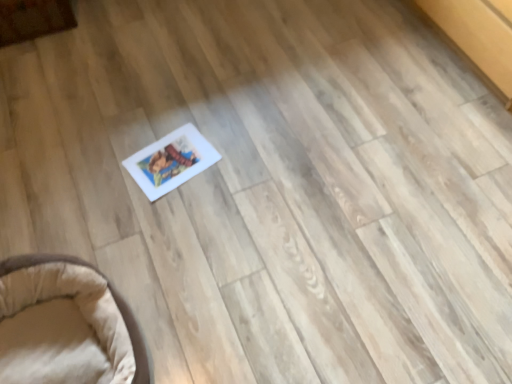
Question: Is beige fabric pet bed at lower left, which is the first furniture in front-to-back order, positioned beyond the bounds of wooden cabinet at upper left, the second furniture in the front-to-back sequence?

Choices:
 (A) no
 (B) yes

Answer: (B)

Question: Considering the relative sizes of beige fabric pet bed at lower left, placed as the 1th furniture when sorted from right to left, and wooden cabinet at upper left, which appears as the second furniture when ordered from the bottom, in the image provided, is beige fabric pet bed at lower left, placed as the 1th furniture when sorted from right to left, shorter than wooden cabinet at upper left, which appears as the second furniture when ordered from the bottom,?

Choices:
 (A) yes
 (B) no

Answer: (B)

Question: Is beige fabric pet bed at lower left, which appears as the second furniture when viewed from the top, facing towards wooden cabinet at upper left, which appears as the second furniture when ordered from the bottom?

Choices:
 (A) no
 (B) yes

Answer: (A)

Question: Can you confirm if beige fabric pet bed at lower left, placed as the 1th furniture when sorted from right to left, is thinner than wooden cabinet at upper left, the 1th furniture from the left?

Choices:
 (A) no
 (B) yes

Answer: (A)

Question: Is beige fabric pet bed at lower left, which appears as the 1th furniture when ordered from the bottom, not close to wooden cabinet at upper left, the second furniture in the front-to-back sequence?

Choices:
 (A) no
 (B) yes

Answer: (B)

Question: Can wooden cabinet at upper left, which appears as the second furniture when ordered from the bottom, be found inside beige fabric pet bed at lower left, which is the first furniture in front-to-back order?

Choices:
 (A) yes
 (B) no

Answer: (B)

Question: Could you tell me if wooden cabinet at upper left, which ranks as the second furniture in right-to-left order, is facing beige fabric pet bed at lower left, which is the first furniture in front-to-back order?

Choices:
 (A) yes
 (B) no

Answer: (A)

Question: From the image's perspective, is wooden cabinet at upper left, the 1th furniture positioned from the top, above beige fabric pet bed at lower left, which is the second furniture from back to front?

Choices:
 (A) yes
 (B) no

Answer: (A)

Question: From a real-world perspective, is wooden cabinet at upper left, the 1th furniture positioned from the top, positioned over beige fabric pet bed at lower left, which appears as the second furniture when viewed from the top, based on gravity?

Choices:
 (A) yes
 (B) no

Answer: (B)

Question: Considering the relative sizes of wooden cabinet at upper left, marked as the first furniture in a back-to-front arrangement, and beige fabric pet bed at lower left, which is the second furniture from back to front, in the image provided, is wooden cabinet at upper left, marked as the first furniture in a back-to-front arrangement, taller than beige fabric pet bed at lower left, which is the second furniture from back to front,?

Choices:
 (A) yes
 (B) no

Answer: (B)

Question: Does wooden cabinet at upper left, the 1th furniture positioned from the top, have a greater width compared to beige fabric pet bed at lower left, placed as the 1th furniture when sorted from right to left?

Choices:
 (A) yes
 (B) no

Answer: (B)

Question: Is wooden cabinet at upper left, marked as the first furniture in a back-to-front arrangement, positioned beyond the bounds of beige fabric pet bed at lower left, which is the second furniture from back to front?

Choices:
 (A) no
 (B) yes

Answer: (B)

Question: Do you think beige fabric pet bed at lower left, which is the first furniture in front-to-back order, is within wooden cabinet at upper left, which ranks as the second furniture in right-to-left order, or outside of it?

Choices:
 (A) outside
 (B) inside

Answer: (A)